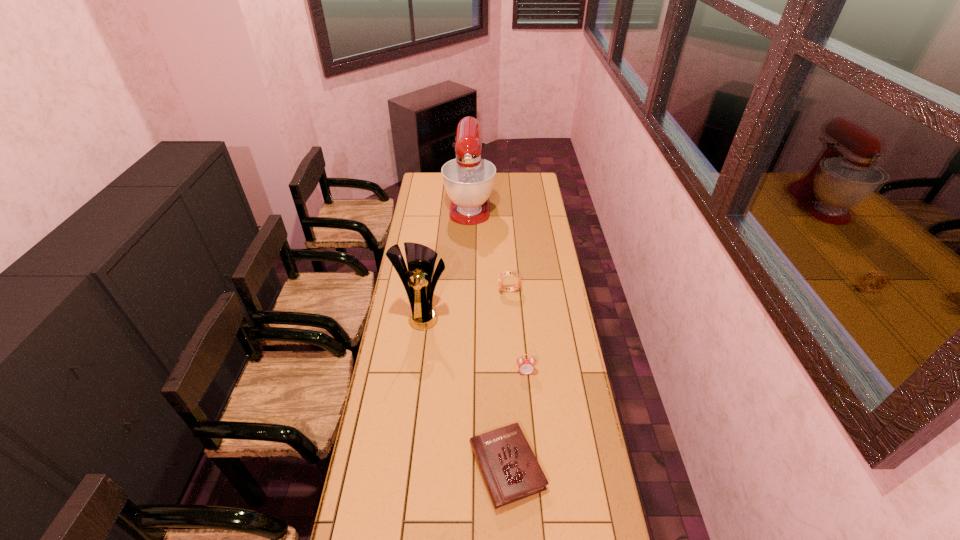
Find the location of a particular element. vacant point located on the face of the second farthest object is located at coordinates (x=457, y=291).

Locate an element on the screen. The image size is (960, 540). free space located 0.390m on the face of the second farthest object is located at coordinates (415, 291).

In order to click on free space located on the face of the second farthest object in this screenshot , I will do `click(453, 291)`.

This screenshot has width=960, height=540. What are the coordinates of `vacant space located 0.400m on the clock face of the alarm clock` in the screenshot? It's located at (536, 479).

At what (x,y) coordinates should I click in order to perform the action: click on vacant space located on the left of the hardback book. Please return your answer as a coordinate pair (x, y). The height and width of the screenshot is (540, 960). Looking at the image, I should click on (444, 467).

Where is `object positioned at the far edge`? Image resolution: width=960 pixels, height=540 pixels. object positioned at the far edge is located at coordinates (468, 180).

Where is `object present at the left edge`? The width and height of the screenshot is (960, 540). object present at the left edge is located at coordinates (421, 259).

In the image, there is a desktop. At what (x,y) coordinates should I click in order to perform the action: click on vacant space at the left edge. Please return your answer as a coordinate pair (x, y). This screenshot has height=540, width=960. Looking at the image, I should click on (436, 215).

In the image, there is a desktop. Where is `free space at the right edge`? The image size is (960, 540). free space at the right edge is located at coordinates (551, 422).

Identify the location of blank space at the far right corner. This screenshot has height=540, width=960. (536, 190).